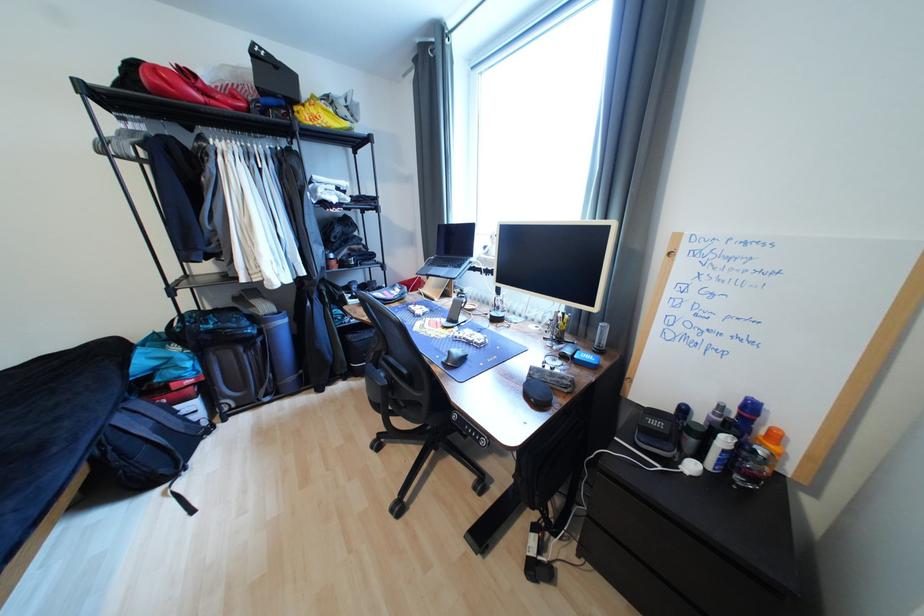
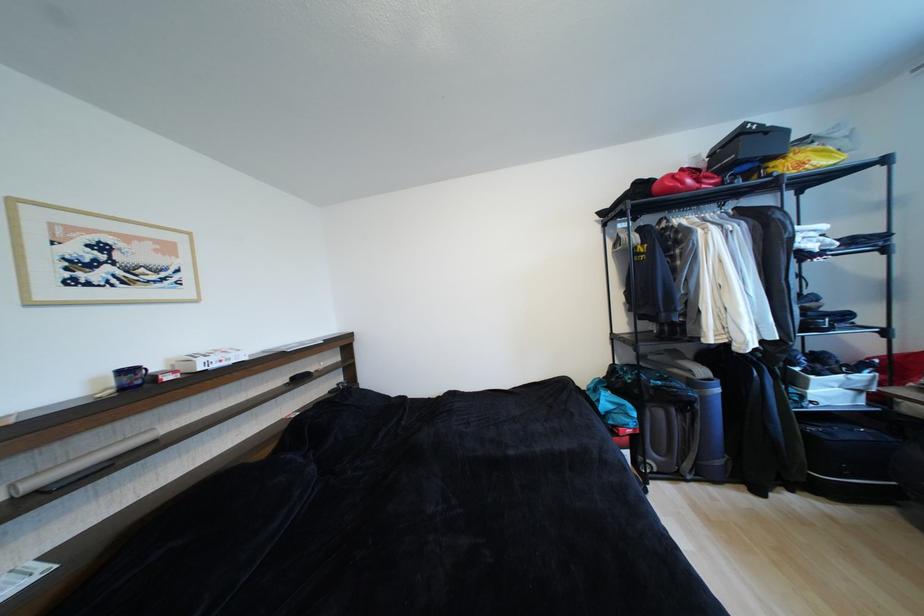
The point at (302, 110) is marked in the first image. Where is the corresponding point in the second image?

(780, 166)